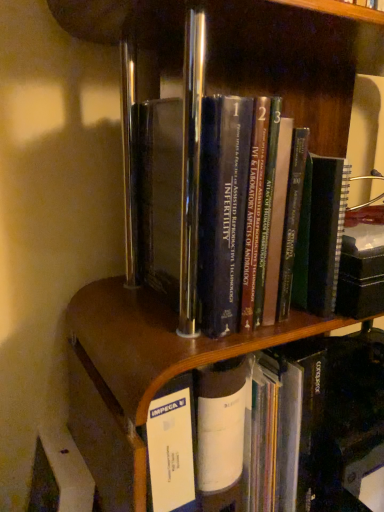
Question: Is hardcover books at center, the second book in the bottom-to-top sequence, facing towards hardcover book at center, acting as the 2th book starting from the top?

Choices:
 (A) no
 (B) yes

Answer: (A)

Question: Is hardcover books at center, placed as the 1th book when sorted from top to bottom, at the right side of hardcover book at center, acting as the first book starting from the bottom?

Choices:
 (A) no
 (B) yes

Answer: (A)

Question: Can you confirm if hardcover books at center, the second book in the bottom-to-top sequence, is shorter than hardcover book at center, acting as the 2th book starting from the top?

Choices:
 (A) no
 (B) yes

Answer: (A)

Question: Does hardcover books at center, the second book in the bottom-to-top sequence, have a greater width compared to hardcover book at center, acting as the first book starting from the bottom?

Choices:
 (A) yes
 (B) no

Answer: (B)

Question: Is hardcover books at center, the second book in the bottom-to-top sequence, oriented away from hardcover book at center, acting as the 2th book starting from the top?

Choices:
 (A) yes
 (B) no

Answer: (B)

Question: Is hardcover books at center, the second book in the bottom-to-top sequence, located outside hardcover book at center, acting as the 2th book starting from the top?

Choices:
 (A) no
 (B) yes

Answer: (B)

Question: Does hardcover book at center, acting as the first book starting from the bottom, have a greater height compared to hardcover books at center, placed as the 1th book when sorted from top to bottom?

Choices:
 (A) no
 (B) yes

Answer: (A)

Question: Does hardcover book at center, acting as the 2th book starting from the top, appear on the right side of hardcover books at center, the second book in the bottom-to-top sequence?

Choices:
 (A) no
 (B) yes

Answer: (B)

Question: Is hardcover book at center, acting as the first book starting from the bottom, positioned before hardcover books at center, placed as the 1th book when sorted from top to bottom?

Choices:
 (A) yes
 (B) no

Answer: (B)

Question: Can you confirm if hardcover book at center, acting as the 2th book starting from the top, is positioned to the left of hardcover books at center, the second book in the bottom-to-top sequence?

Choices:
 (A) yes
 (B) no

Answer: (B)

Question: From a real-world perspective, is hardcover book at center, acting as the 2th book starting from the top, on top of hardcover books at center, placed as the 1th book when sorted from top to bottom?

Choices:
 (A) yes
 (B) no

Answer: (B)

Question: From the image's perspective, is hardcover book at center, acting as the 2th book starting from the top, under hardcover books at center, the second book in the bottom-to-top sequence?

Choices:
 (A) yes
 (B) no

Answer: (A)

Question: From a real-world perspective, is hardcover books at center, the second book in the bottom-to-top sequence, above or below hardcover book at center, acting as the first book starting from the bottom?

Choices:
 (A) above
 (B) below

Answer: (A)